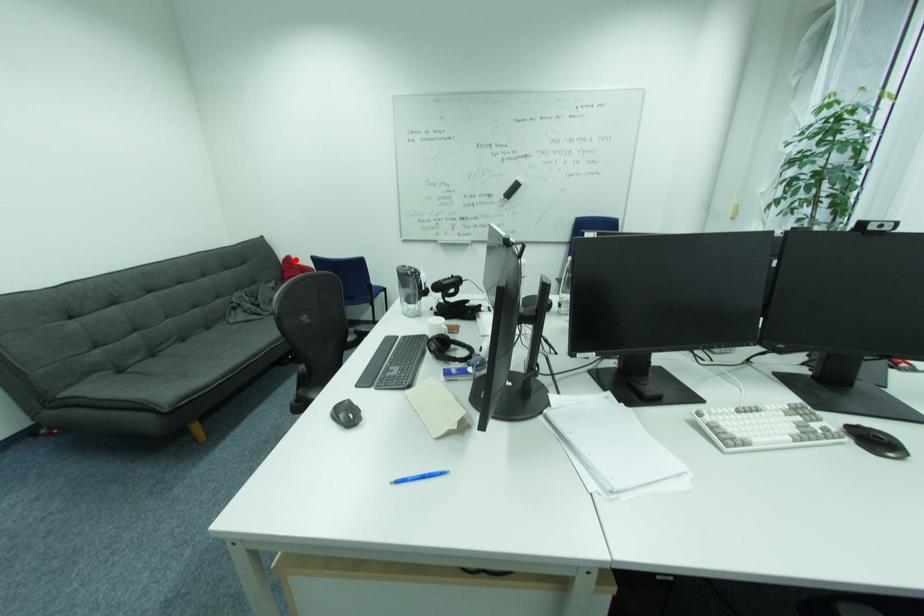
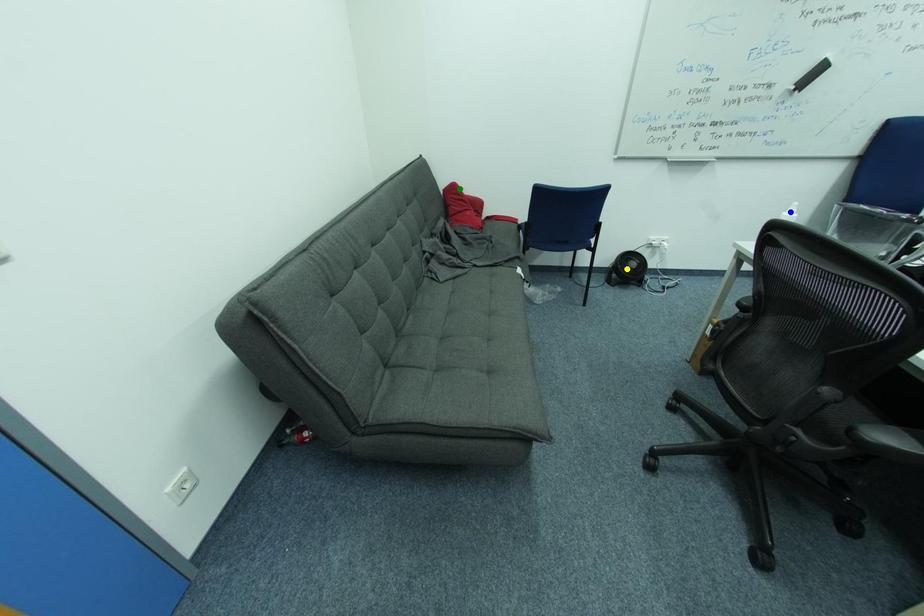
Question: I am providing you with two images of the same scene from different viewpoints. A red point is marked on the first image. You are given multiple points on the second image. Which point in image 2 is actually the same real-world point as the red point in image 1?

Choices:
 (A) green point
 (B) yellow point
 (C) blue point

Answer: (A)